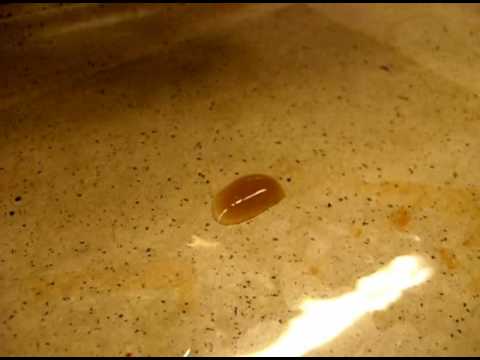
Where is `countertop`? countertop is located at coordinates (297, 134).